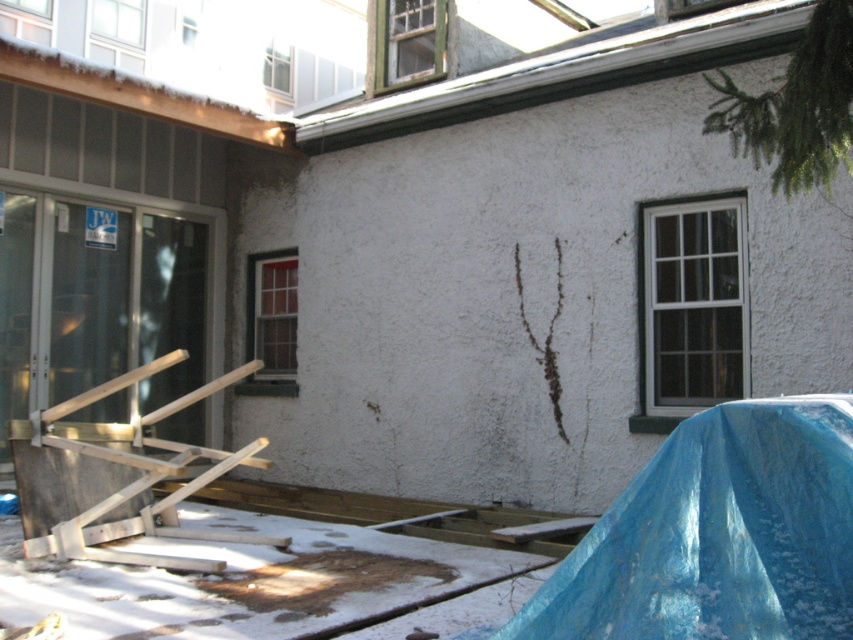
Question: Does blue plastic tarp at lower right lie in front of clear glass screen door at left?

Choices:
 (A) no
 (B) yes

Answer: (B)

Question: Which of the following is the closest to the observer?

Choices:
 (A) (850, 520)
 (B) (158, 237)

Answer: (A)

Question: Can you confirm if blue plastic tarp at lower right is wider than clear glass screen door at left?

Choices:
 (A) yes
 (B) no

Answer: (B)

Question: Which of the following is the farthest from the observer?

Choices:
 (A) blue plastic tarp at lower right
 (B) clear glass screen door at left

Answer: (B)

Question: Observing the image, what is the correct spatial positioning of blue plastic tarp at lower right in reference to clear glass screen door at left?

Choices:
 (A) above
 (B) below

Answer: (B)